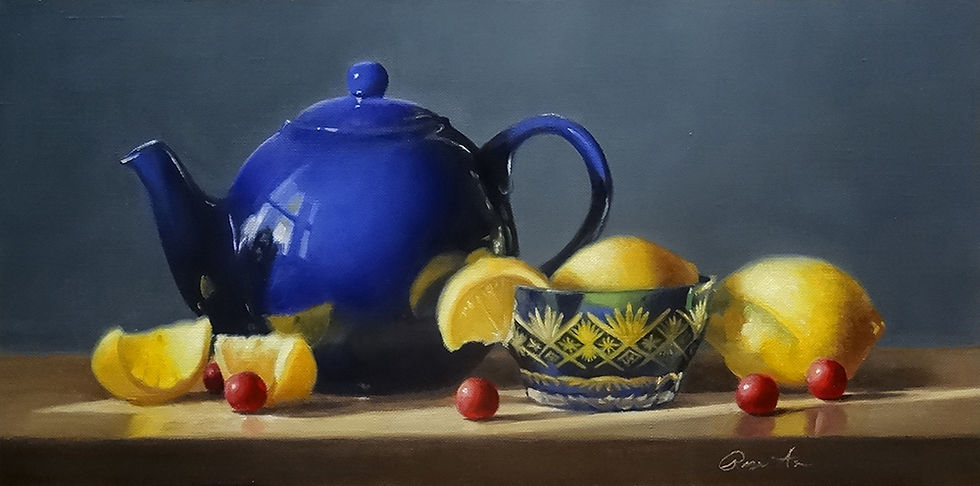
Identify the location of blue tea pot on top of table. (365, 195).